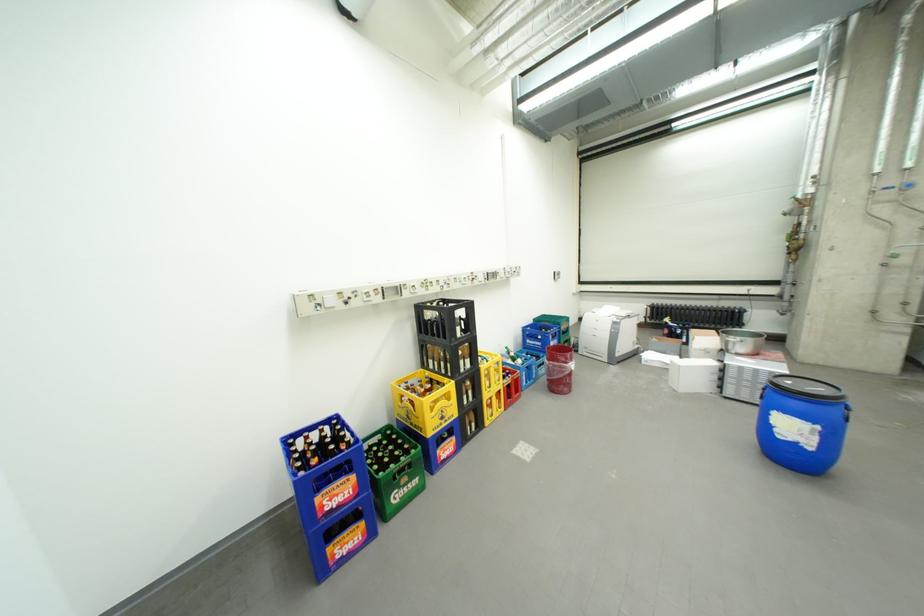
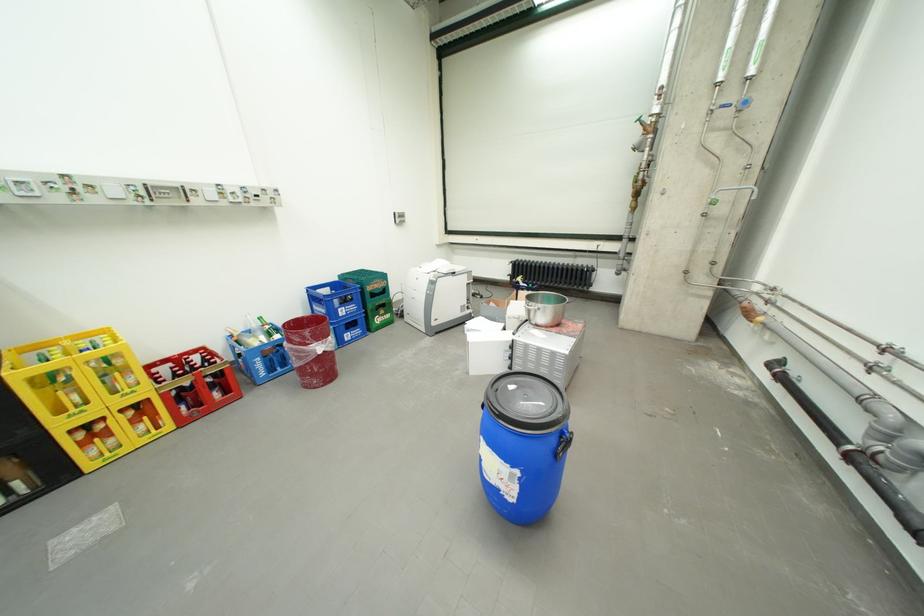
In the second image, find the point that corresponds to pixel 674 390 in the first image.

(468, 371)